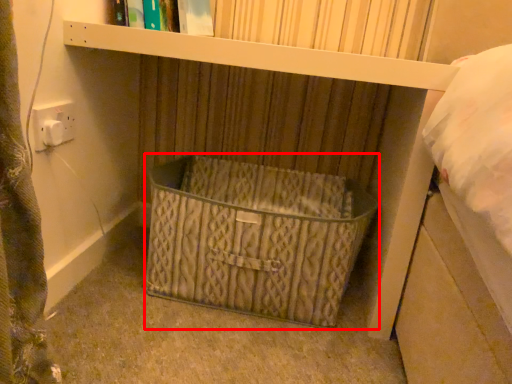
Question: Where is basket (annotated by the red box) located in relation to book in the image?

Choices:
 (A) left
 (B) right

Answer: (B)